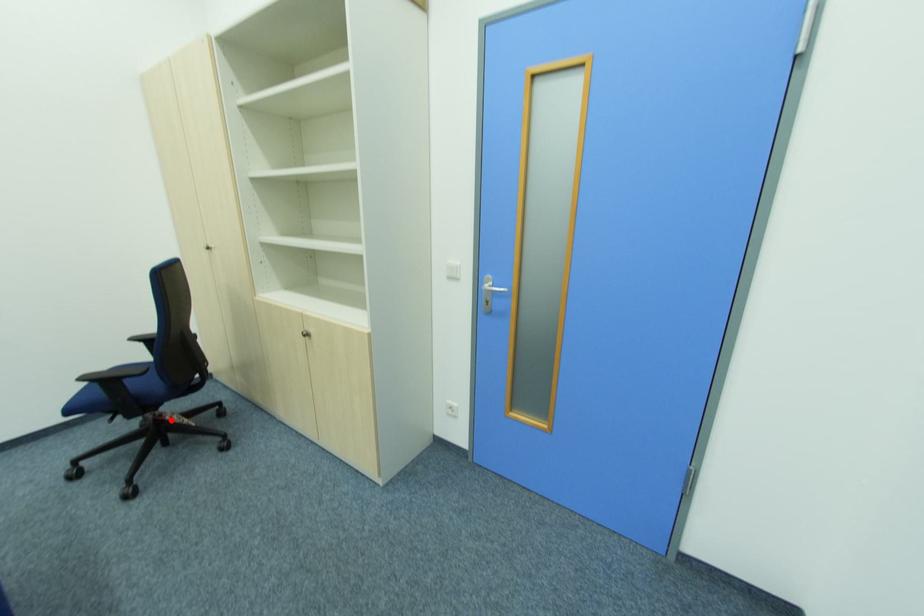
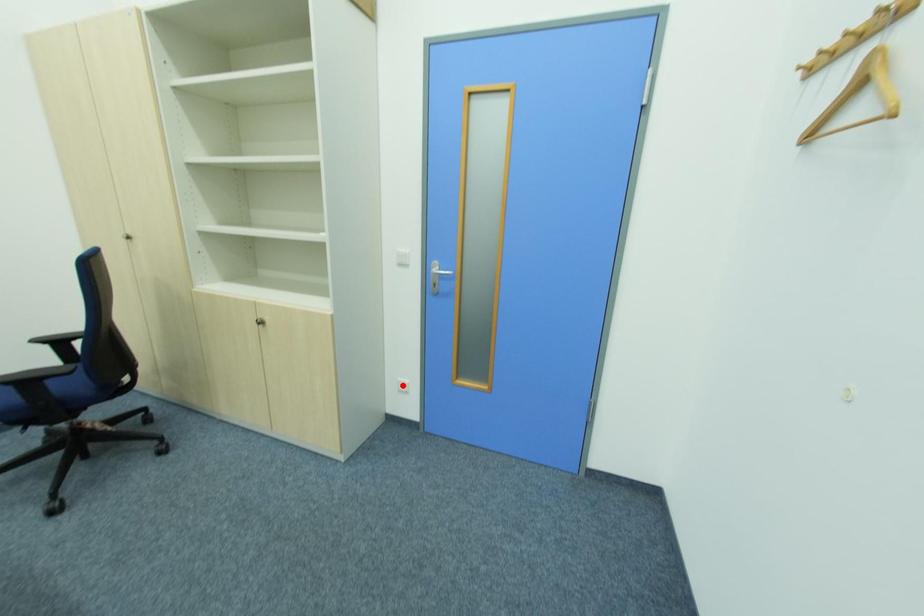
I am providing you with two images of the same scene from different viewpoints. A red point is marked on the first image and another point is marked on the second image. Do the highlighted points in image1 and image2 indicate the same real-world spot?

No